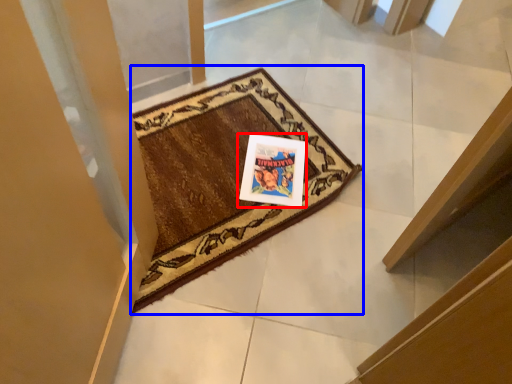
Question: Among these objects, which one is farthest to the camera, picture frame (highlighted by a red box) or mat (highlighted by a blue box)?

Choices:
 (A) picture frame
 (B) mat

Answer: (A)